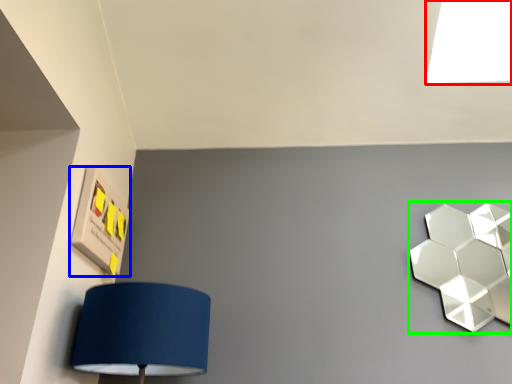
Question: Which is nearer to the light (highlighted by a red box)? square (highlighted by a blue box) or lamp (highlighted by a green box).

Choices:
 (A) square
 (B) lamp

Answer: (B)